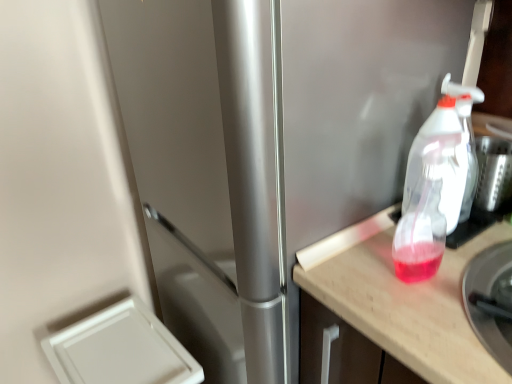
This screenshot has height=384, width=512. I want to click on free space above white plastic drawer at lower left, acting as the first appliance starting from the back (from a real-world perspective), so click(117, 350).